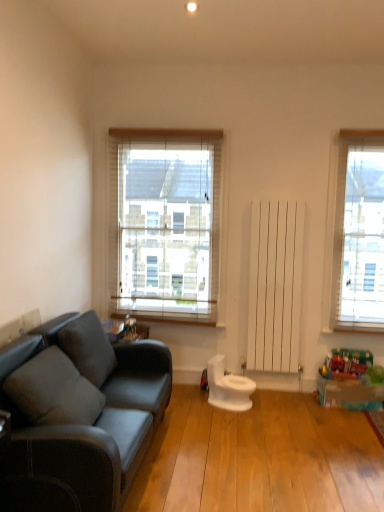
Locate an element on the screen. empty space that is ontop of white wood blinds at center (from a real-world perspective) is located at coordinates (157, 126).